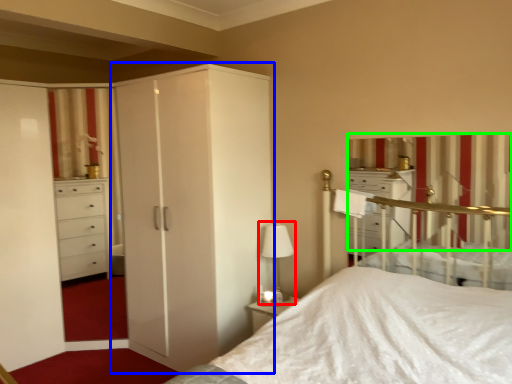
Question: Estimate the real-world distances between objects in this image. Which object is closer to table lamp (highlighted by a red box), cupboard (highlighted by a blue box) or curtain (highlighted by a green box)?

Choices:
 (A) cupboard
 (B) curtain

Answer: (A)